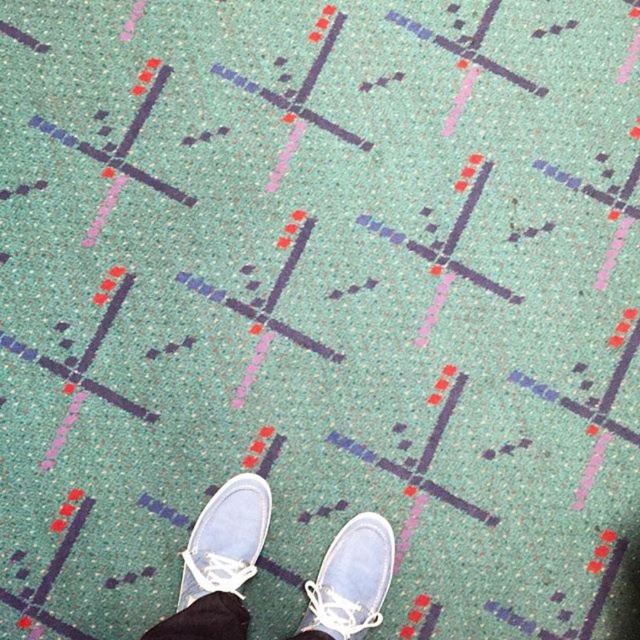
Question: From the image, what is the correct spatial relationship of white canvas shoes at center in relation to white canvas shoe at center?

Choices:
 (A) above
 (B) below

Answer: (B)

Question: Estimate the real-world distances between objects in this image. Which object is farther from the white suede shoe at lower center?

Choices:
 (A) white canvas shoes at center
 (B) white canvas shoe at center

Answer: (B)

Question: Which of the following is the closest to the observer?

Choices:
 (A) white suede shoe at lower center
 (B) white canvas shoe at center

Answer: (A)

Question: Can you confirm if white canvas shoes at center is thinner than white suede shoe at lower center?

Choices:
 (A) yes
 (B) no

Answer: (B)

Question: Can you confirm if white suede shoe at lower center is smaller than white canvas shoe at center?

Choices:
 (A) no
 (B) yes

Answer: (A)

Question: Which point is farther from the camera taking this photo?

Choices:
 (A) (385, 570)
 (B) (324, 620)

Answer: (A)